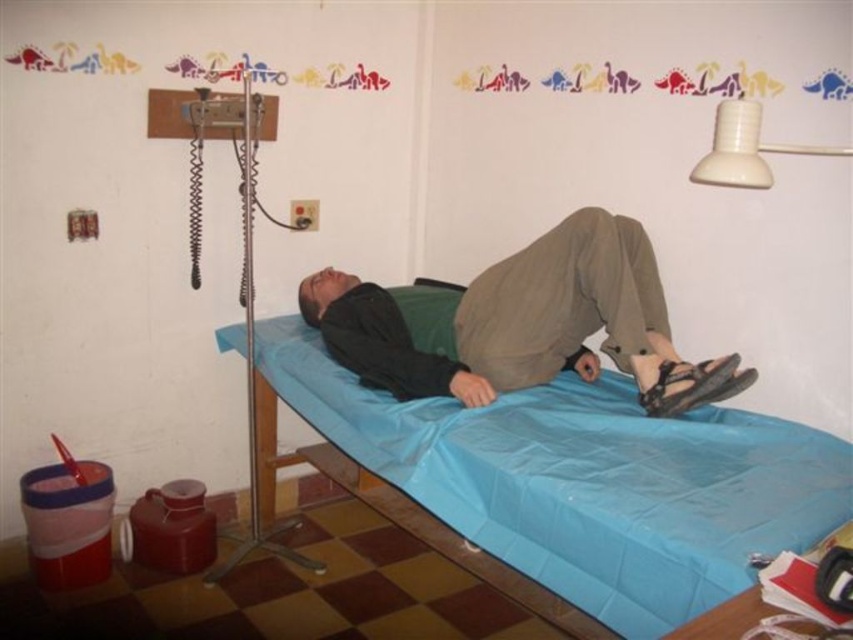
Based on the coordinates provided, which object in the scene is located at point (583, 481)?

The point (583, 481) corresponds to the blue fabric mattress at center.

You are a nurse checking the patient in the room. You need to adjust the blue fabric mattress at center and the brown matte pants at center. Which object is closer to you so you can reach it first?

The blue fabric mattress at center is closer to the viewer than the brown matte pants at center, so you can reach it first.